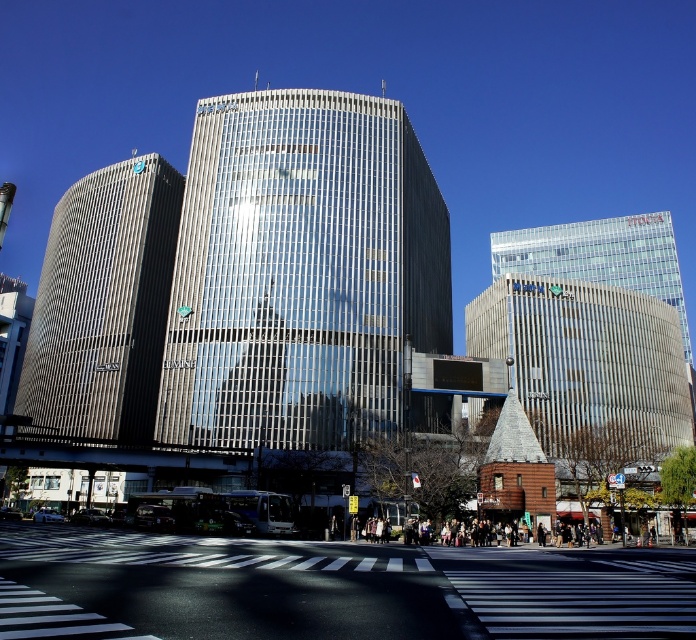
Can you confirm if glassy reflective building at center is shorter than transparent glass building at upper right?

No.

The image size is (696, 640). I want to click on glassy reflective building at center, so click(x=301, y=272).

Can you confirm if glassy reflective building at center is positioned to the left of metallic silver building at left?

No, glassy reflective building at center is not to the left of metallic silver building at left.

Is glassy reflective building at center above metallic silver building at left?

Indeed, glassy reflective building at center is positioned over metallic silver building at left.

What do you see at coordinates (301, 272) in the screenshot? The height and width of the screenshot is (640, 696). I see `glassy reflective building at center` at bounding box center [301, 272].

Identify the location of glassy reflective building at center. This screenshot has width=696, height=640. pyautogui.click(x=301, y=272).

Which is behind, point (590, 404) or point (516, 250)?

The point (516, 250) is behind.

Locate an element on the screen. The height and width of the screenshot is (640, 696). brown wooden tower at center is located at coordinates (587, 364).

You are a GUI agent. You are given a task and a screenshot of the screen. Output one action in this format:
    pyautogui.click(x=<x>, y=<y>)
    Task: Click on the brown wooden tower at center
    
    Given the screenshot: What is the action you would take?
    pyautogui.click(x=587, y=364)